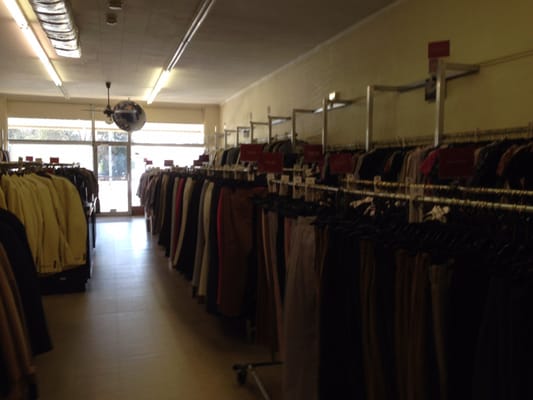
Locate an element on the screen. Image resolution: width=533 pixels, height=400 pixels. broken light is located at coordinates (185, 36).